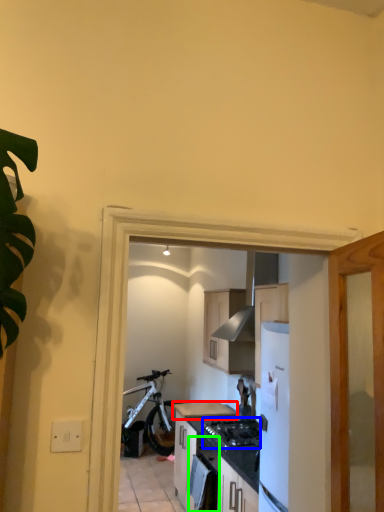
Question: Which object is positioned closest to countertop (highlighted by a red box)? Select from gas stove (highlighted by a blue box) and oven (highlighted by a green box).

Choices:
 (A) gas stove
 (B) oven

Answer: (A)